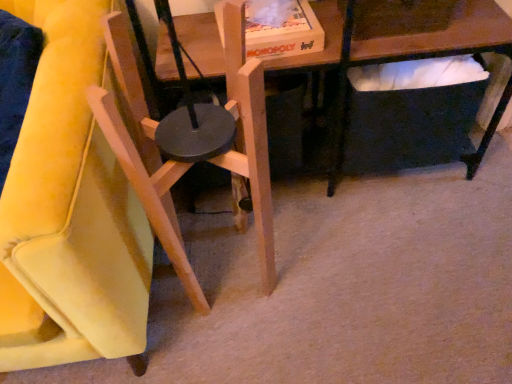
Question: From their relative heights in the image, would you say natural wood chair at center, which is the second chair from left to right, is taller or shorter than wooden chair at left, arranged as the first chair when viewed from the left?

Choices:
 (A) tall
 (B) short

Answer: (B)

Question: Considering the positions of natural wood chair at center, which is the second chair from left to right, and wooden chair at left, which is counted as the second chair, starting from the right, in the image, is natural wood chair at center, which is the second chair from left to right, wider or thinner than wooden chair at left, which is counted as the second chair, starting from the right,?

Choices:
 (A) wide
 (B) thin

Answer: (B)

Question: Is point (253, 135) closer or farther from the camera than point (42, 233)?

Choices:
 (A) closer
 (B) farther

Answer: (B)

Question: Considering the positions of wooden chair at left, arranged as the first chair when viewed from the left, and natural wood chair at center, which is the second chair from left to right, in the image, is wooden chair at left, arranged as the first chair when viewed from the left, taller or shorter than natural wood chair at center, which is the second chair from left to right,?

Choices:
 (A) tall
 (B) short

Answer: (A)

Question: From the image's perspective, is wooden chair at left, which is counted as the second chair, starting from the right, above or below natural wood chair at center, which is the second chair from left to right?

Choices:
 (A) below
 (B) above

Answer: (B)

Question: Based on their sizes in the image, would you say wooden chair at left, arranged as the first chair when viewed from the left, is bigger or smaller than natural wood chair at center, positioned as the first chair in right-to-left order?

Choices:
 (A) small
 (B) big

Answer: (B)

Question: Relative to natural wood chair at center, positioned as the first chair in right-to-left order, is wooden chair at left, arranged as the first chair when viewed from the left, in front or behind?

Choices:
 (A) front
 (B) behind

Answer: (A)